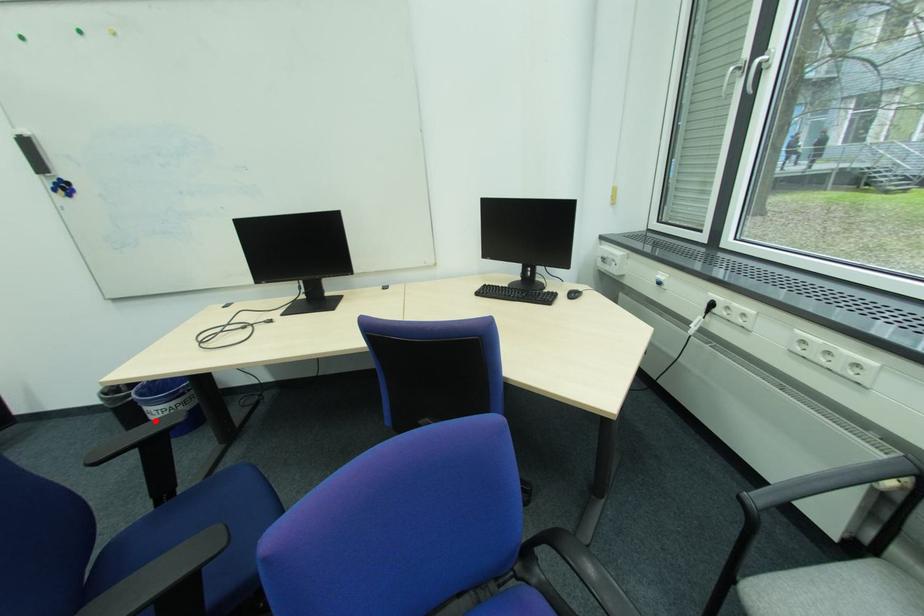
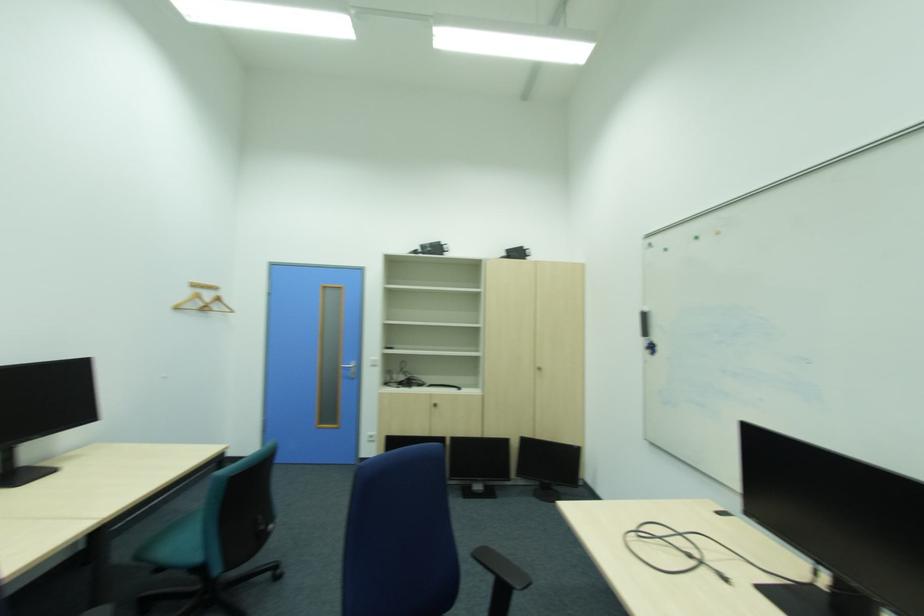
Question: I am providing you with two images of the same scene from different viewpoints. A red point is marked on the first image. Can you still see the location of the red point in image 2?

Choices:
 (A) Yes
 (B) No

Answer: (B)